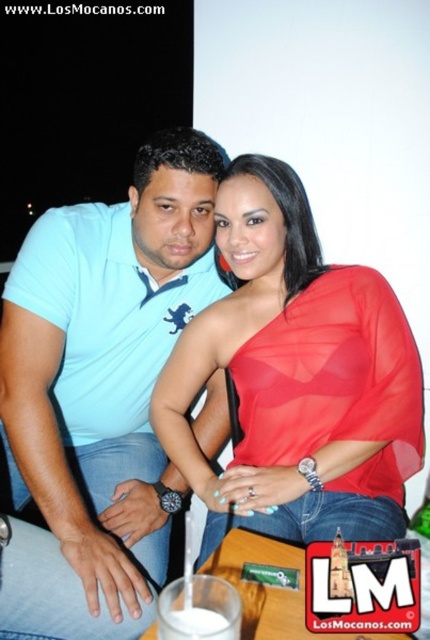
Question: Considering the relative positions of light blue cotton shirt at center and shiny red blouse at center in the image provided, where is light blue cotton shirt at center located with respect to shiny red blouse at center?

Choices:
 (A) below
 (B) above

Answer: (A)

Question: Which of the following is the farthest from the observer?

Choices:
 (A) (232, 518)
 (B) (36, 259)

Answer: (B)

Question: Which point appears closest to the camera in this image?

Choices:
 (A) (286, 196)
 (B) (125, 577)

Answer: (B)

Question: Does light blue cotton shirt at center appear over shiny red blouse at center?

Choices:
 (A) yes
 (B) no

Answer: (B)

Question: Is light blue cotton shirt at center thinner than shiny red blouse at center?

Choices:
 (A) yes
 (B) no

Answer: (A)